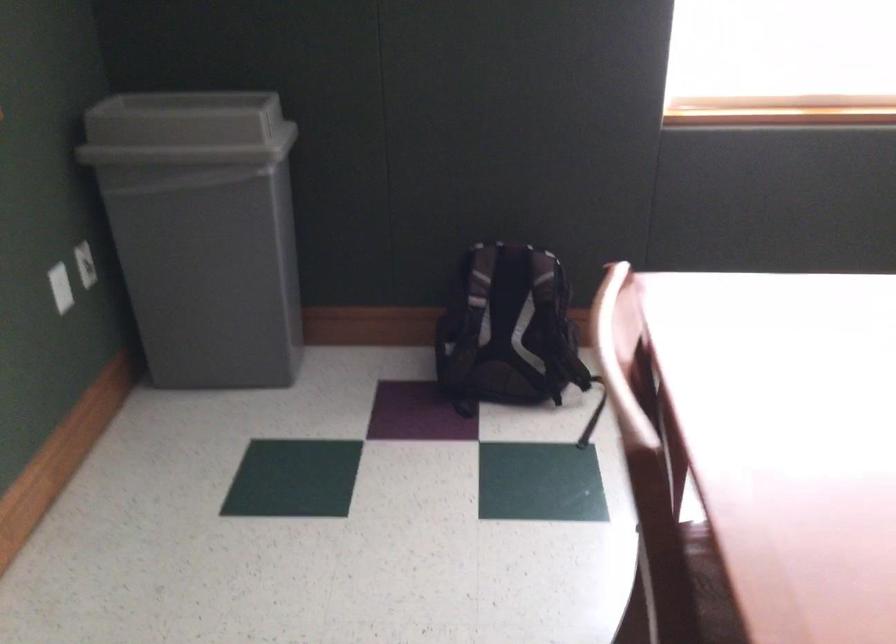
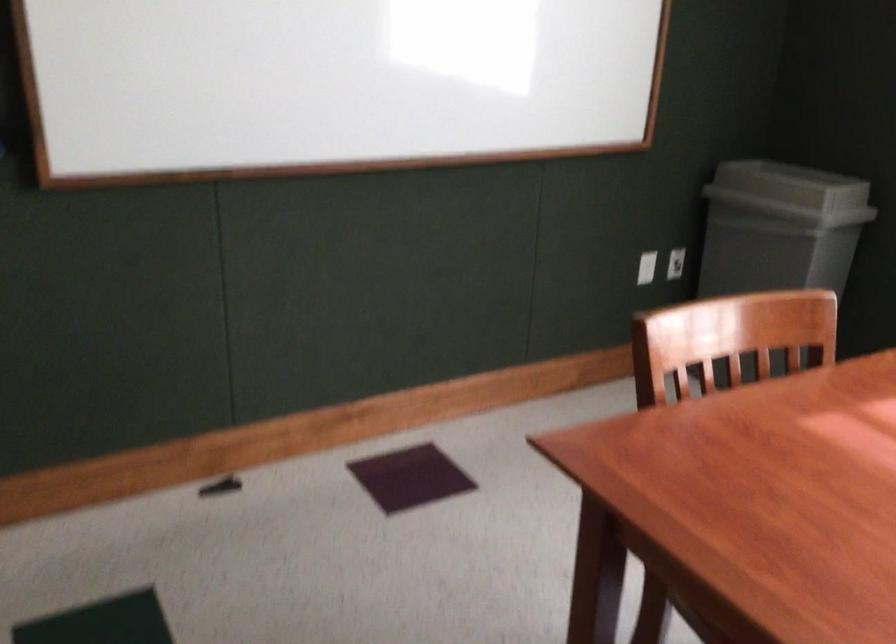
Where in the second image is the point corresponding to the point at 93,270 from the first image?

(675, 263)